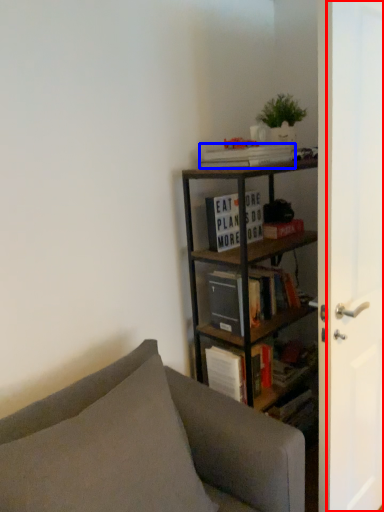
Question: Which point is closer to the camera, screen door (highlighted by a red box) or book (highlighted by a blue box)?

Choices:
 (A) screen door
 (B) book

Answer: (A)